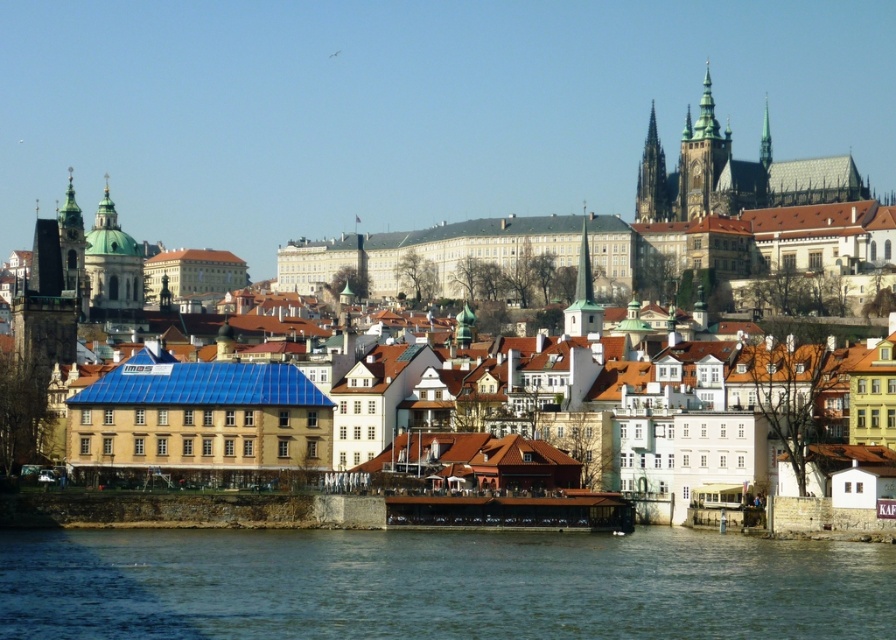
Is point (134, 260) positioned after point (688, 216)?

No.

Does green domed tower at upper left appear on the right side of green stone tower at upper center?

Incorrect, green domed tower at upper left is not on the right side of green stone tower at upper center.

Locate an element on the screen. Image resolution: width=896 pixels, height=640 pixels. green domed tower at upper left is located at coordinates (112, 260).

Between greenish-blue water at lower center and smooth stone spire at upper right, which one appears on the left side from the viewer's perspective?

Positioned to the left is greenish-blue water at lower center.

Does greenish-blue water at lower center appear on the left side of smooth stone spire at upper right?

Indeed, greenish-blue water at lower center is positioned on the left side of smooth stone spire at upper right.

At what (x,y) coordinates should I click in order to perform the action: click on greenish-blue water at lower center. Please return your answer as a coordinate pair (x, y). This screenshot has width=896, height=640. Looking at the image, I should click on (438, 584).

Is smooth stone spire at upper right smaller than green stone spire at upper right?

Indeed, smooth stone spire at upper right has a smaller size compared to green stone spire at upper right.

Can you confirm if smooth stone spire at upper right is positioned to the left of green stone spire at upper right?

Indeed, smooth stone spire at upper right is positioned on the left side of green stone spire at upper right.

Who is more distant from viewer, [647,205] or [770,160]?

Positioned behind is point [770,160].

Where is `smooth stone spire at upper right`? This screenshot has height=640, width=896. smooth stone spire at upper right is located at coordinates (653, 179).